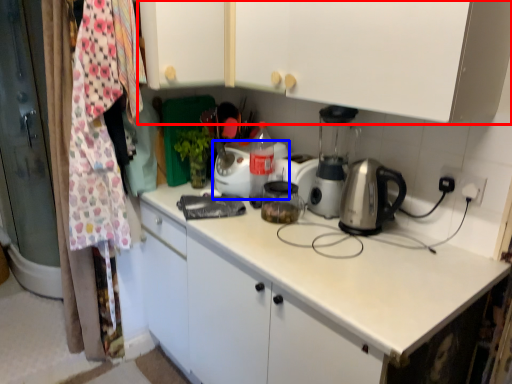
Question: Which object is further to the camera taking this photo, cabinetry (highlighted by a red box) or kitchen appliance (highlighted by a blue box)?

Choices:
 (A) cabinetry
 (B) kitchen appliance

Answer: (B)